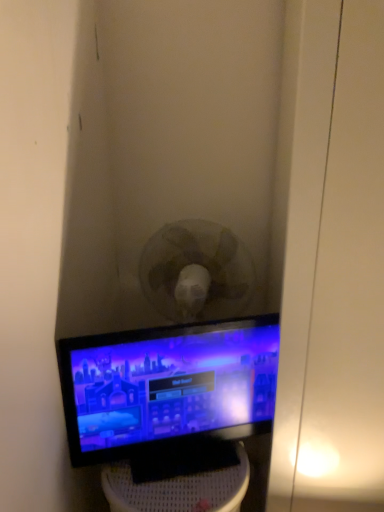
Question: Does black matte monitor at center turn towards matte black monitor at center?

Choices:
 (A) yes
 (B) no

Answer: (B)

Question: Are black matte monitor at center and matte black monitor at center located far from each other?

Choices:
 (A) no
 (B) yes

Answer: (A)

Question: Is black matte monitor at center to the right of matte black monitor at center from the viewer's perspective?

Choices:
 (A) yes
 (B) no

Answer: (B)

Question: Does black matte monitor at center have a smaller size compared to matte black monitor at center?

Choices:
 (A) yes
 (B) no

Answer: (B)

Question: Is black matte monitor at center located outside matte black monitor at center?

Choices:
 (A) yes
 (B) no

Answer: (A)

Question: Considering the relative positions of black matte monitor at center and matte black monitor at center in the image provided, is black matte monitor at center to the left of matte black monitor at center from the viewer's perspective?

Choices:
 (A) no
 (B) yes

Answer: (B)

Question: Is matte black monitor at center taller than black matte monitor at center?

Choices:
 (A) yes
 (B) no

Answer: (B)

Question: Is matte black monitor at center oriented towards black matte monitor at center?

Choices:
 (A) yes
 (B) no

Answer: (B)

Question: Is matte black monitor at center wider than black matte monitor at center?

Choices:
 (A) yes
 (B) no

Answer: (B)

Question: Is matte black monitor at center facing away from black matte monitor at center?

Choices:
 (A) no
 (B) yes

Answer: (A)

Question: From the image's perspective, is matte black monitor at center on top of black matte monitor at center?

Choices:
 (A) no
 (B) yes

Answer: (B)

Question: From the image's perspective, does matte black monitor at center appear lower than black matte monitor at center?

Choices:
 (A) no
 (B) yes

Answer: (A)

Question: Looking at their shapes, would you say matte black monitor at center is wider or thinner than black matte monitor at center?

Choices:
 (A) thin
 (B) wide

Answer: (A)